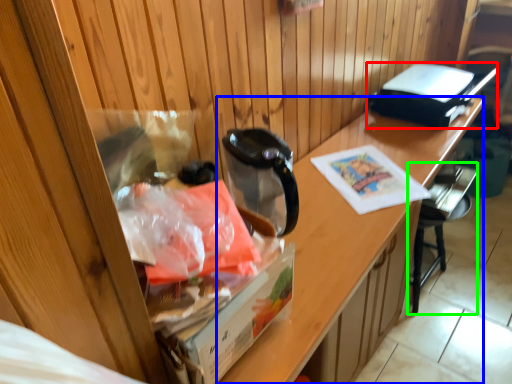
Question: Which is farther away from appliance (highlighted by a red box)? desk (highlighted by a blue box) or chair (highlighted by a green box)?

Choices:
 (A) desk
 (B) chair

Answer: (B)